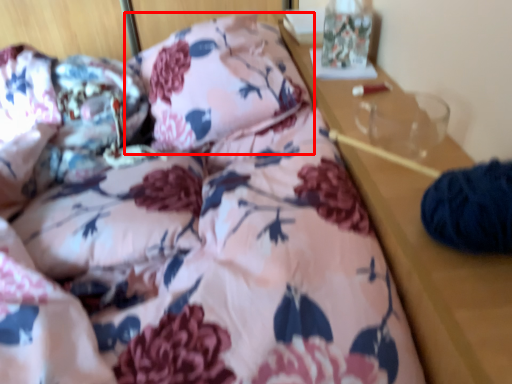
Question: From the image's perspective, considering the relative positions of pillow (annotated by the red box) and pillow in the image provided, where is pillow (annotated by the red box) located with respect to the staircase?

Choices:
 (A) above
 (B) below

Answer: (A)